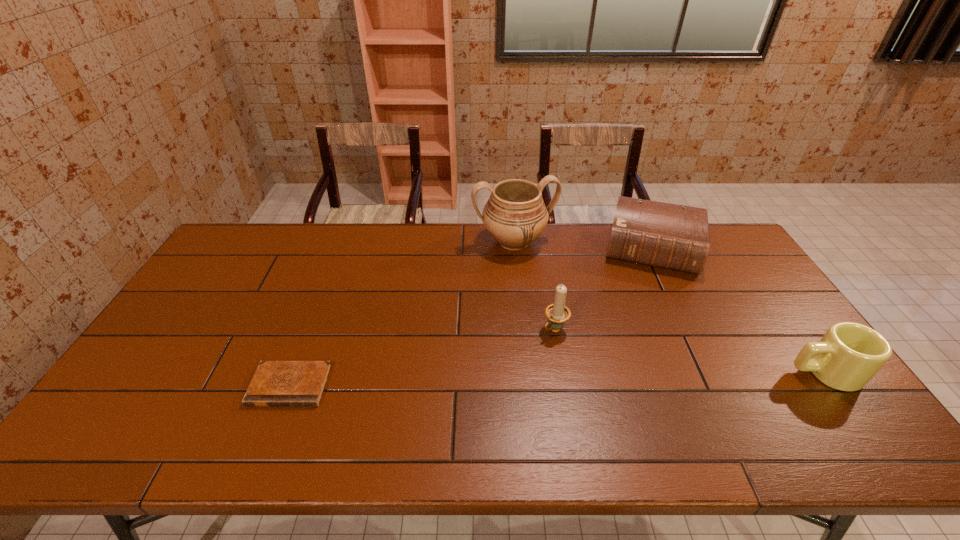
Find the location of `Bible positioned at the far edge`. Bible positioned at the far edge is located at coordinates (670, 236).

Where is `diary at the near edge`? diary at the near edge is located at coordinates (275, 383).

The image size is (960, 540). I want to click on mug that is at the near edge, so click(849, 354).

Locate an element on the screen. mug located in the right edge section of the desktop is located at coordinates (849, 354).

Locate an element on the screen. Image resolution: width=960 pixels, height=540 pixels. Bible that is positioned at the right edge is located at coordinates (670, 236).

You are a GUI agent. You are given a task and a screenshot of the screen. Output one action in this format:
    pyautogui.click(x=<x>, y=<y>)
    Task: Click on the object present at the far right corner
    The height and width of the screenshot is (540, 960).
    Given the screenshot: What is the action you would take?
    pyautogui.click(x=670, y=236)

Where is `object positioned at the near right corner`? The width and height of the screenshot is (960, 540). object positioned at the near right corner is located at coordinates (849, 354).

Identify the location of vacant area at the far edge of the desktop. (606, 250).

At what (x,y) coordinates should I click in order to perform the action: click on vacant space at the near edge. Please return your answer as a coordinate pair (x, y). Looking at the image, I should click on 735,389.

Identify the location of vacant space at the left edge. This screenshot has height=540, width=960. (199, 328).